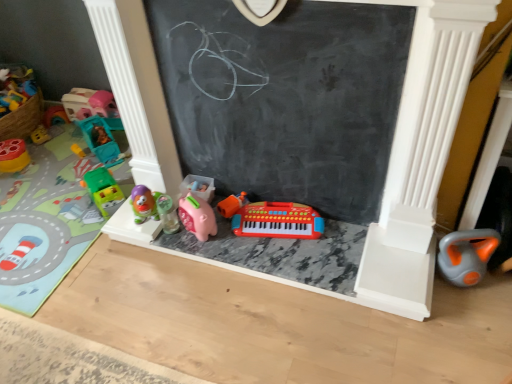
This screenshot has height=384, width=512. What are the coordinates of `vacant space in between translucent plastic toy car at left, which is the fourth toy in left-to-right order, and matte yellow and red toy at left, the 1th toy from the left` in the screenshot? It's located at (48, 157).